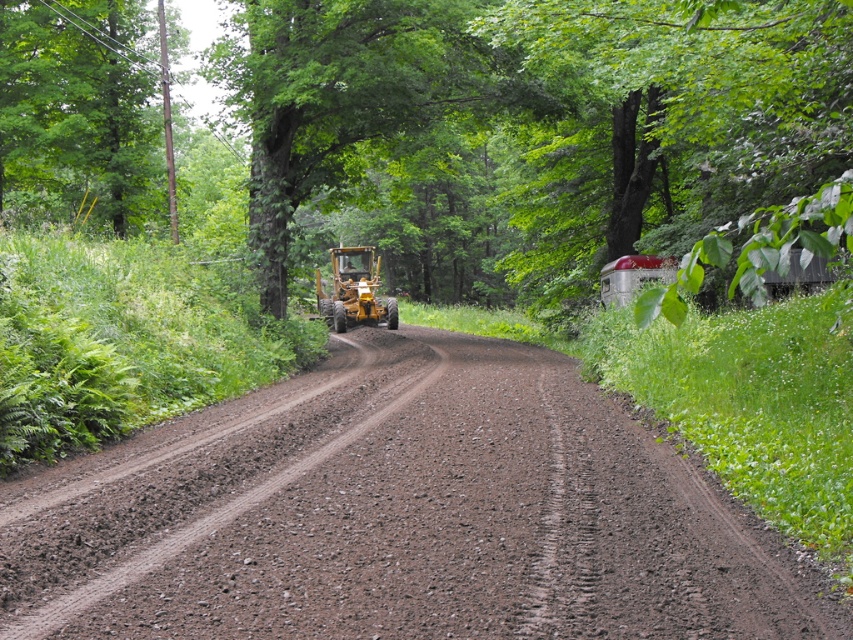
Question: Does green leafy tree at upper right come in front of green leafy tree at upper left?

Choices:
 (A) yes
 (B) no

Answer: (A)

Question: Among these points, which one is nearest to the camera?

Choices:
 (A) (380, 304)
 (B) (757, 131)
 (C) (144, 161)

Answer: (B)

Question: Considering the relative positions of brown gravel dirt track at center and yellow rubber tractor at center in the image provided, where is brown gravel dirt track at center located with respect to yellow rubber tractor at center?

Choices:
 (A) below
 (B) above

Answer: (A)

Question: In this image, where is brown gravel dirt track at center located relative to green leafy tree at upper right?

Choices:
 (A) left
 (B) right

Answer: (A)

Question: Which of the following is the farthest from the observer?

Choices:
 (A) click(654, 179)
 (B) click(155, 456)
 (C) click(322, 292)
 (D) click(27, 148)

Answer: (C)

Question: Which of the following is the farthest from the observer?

Choices:
 (A) (364, 301)
 (B) (109, 17)

Answer: (A)